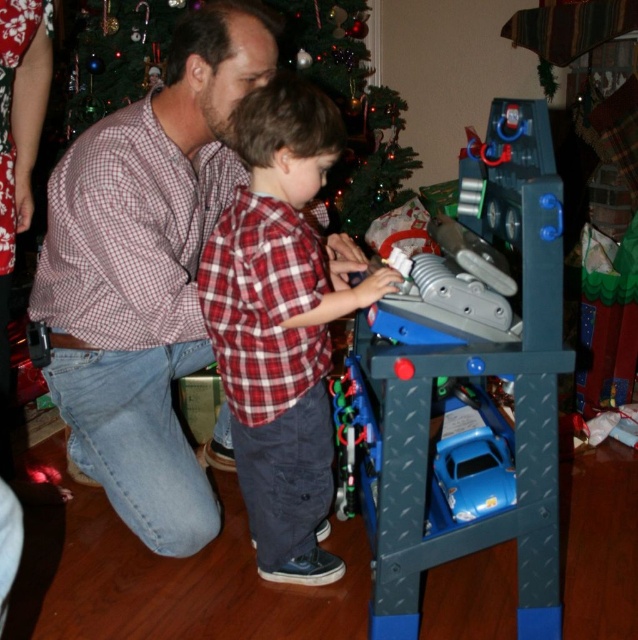
You are a guest at this holiday gathering and want to place a gift under the Christmas tree. The gift is too large to carry, so you need to roll it. There is a red plaid shirt at center and a blue plastic car at lower center in the way. Which object should you move first to clear a path?

You should move the blue plastic car at lower center first because the red plaid shirt at center is to the left of it, meaning the car is closer to your path. Clearing the car first would allow you to create space to move the shirt if needed.

You are a guest at a Christmas party and want to place a gift under the green matte christmas tree at upper center. However, there is a blue plastic car at lower center in the way. Based on their positions, can you move the car to make space?

The green matte christmas tree at upper center is positioned over the blue plastic car at lower center, meaning the car is directly beneath the tree. To place the gift under the tree, you would need to move the blue plastic car at lower center out of the way since it is blocking the space underneath the tree.